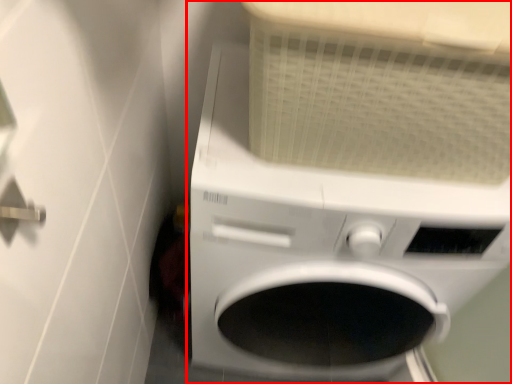
Question: Observing the image, what is the correct spatial positioning of washing machine (annotated by the red box) in reference to door handle?

Choices:
 (A) right
 (B) left

Answer: (A)